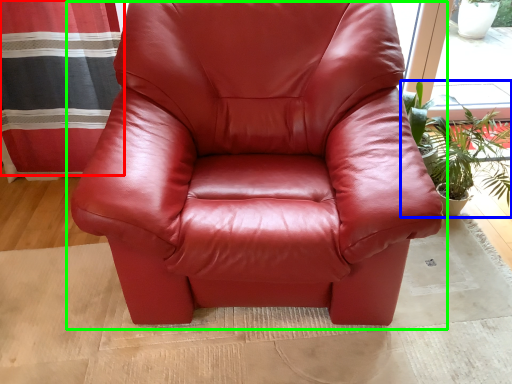
Question: Considering the real-world distances, which object is farthest from curtain (highlighted by a red box)? houseplant (highlighted by a blue box) or chair (highlighted by a green box)?

Choices:
 (A) houseplant
 (B) chair

Answer: (A)